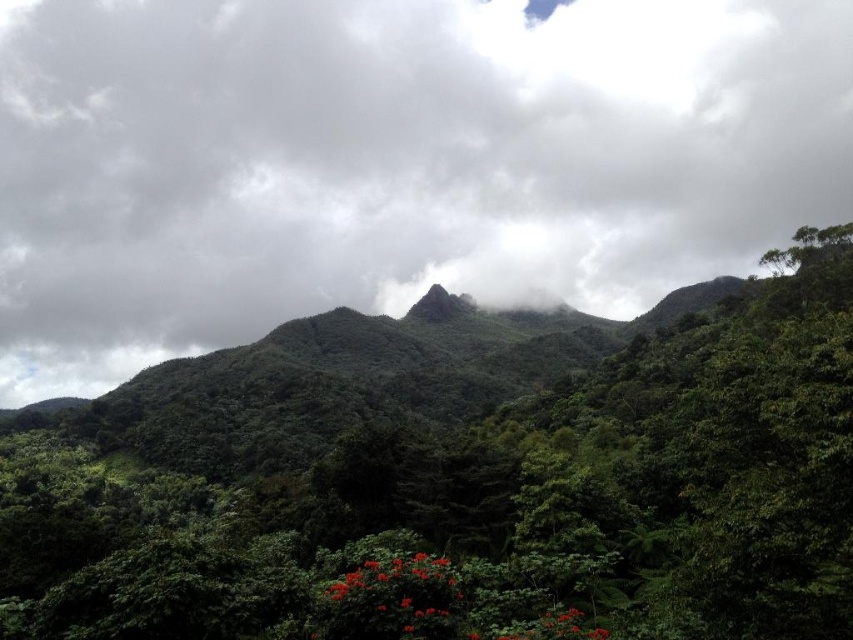
Question: Is cloudy sky at center below green leafy tree at center?

Choices:
 (A) yes
 (B) no

Answer: (B)

Question: Which point is farther to the camera?

Choices:
 (A) cloudy sky at center
 (B) green leafy tree at center

Answer: (A)

Question: Which point appears farthest from the camera in this image?

Choices:
 (A) (21, 157)
 (B) (442, 484)

Answer: (A)

Question: Considering the relative positions of cloudy sky at center and green leafy tree at center in the image provided, where is cloudy sky at center located with respect to green leafy tree at center?

Choices:
 (A) left
 (B) right

Answer: (A)

Question: Is cloudy sky at center to the right of green leafy tree at center from the viewer's perspective?

Choices:
 (A) no
 (B) yes

Answer: (A)

Question: Among these points, which one is farthest from the camera?

Choices:
 (A) (354, 90)
 (B) (538, 396)

Answer: (A)